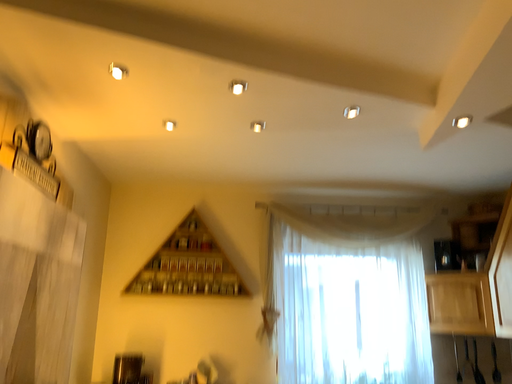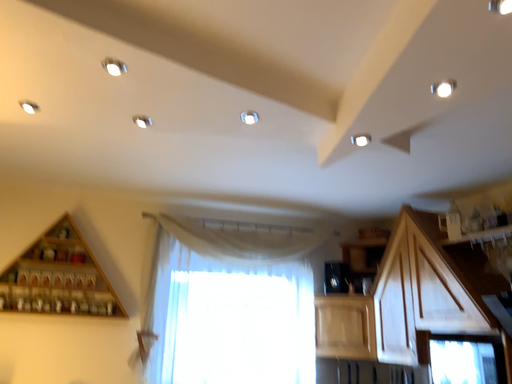
Question: Which way did the camera rotate in the video?

Choices:
 (A) rotated left
 (B) rotated right

Answer: (B)